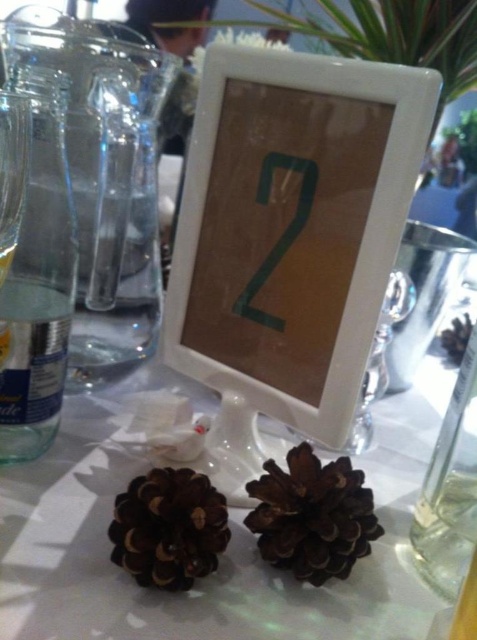
Question: Does brown textured pine cone at center appear over brown matte pine cone at lower left?

Choices:
 (A) yes
 (B) no

Answer: (A)

Question: Which of the following is the closest to the observer?

Choices:
 (A) (448, 429)
 (B) (140, 484)

Answer: (B)

Question: Can you confirm if brown matte pine cone at lower left is positioned above clear glass bottle at right?

Choices:
 (A) no
 (B) yes

Answer: (A)

Question: Which point is farther to the camera?

Choices:
 (A) clear glass bottle at left
 (B) clear glass bottle at right

Answer: (B)

Question: Which point is farther from the camera taking this photo?

Choices:
 (A) (13, 266)
 (B) (284, 230)
 (C) (311, 529)
 (D) (201, 573)

Answer: (B)

Question: Considering the relative positions of clear glass bottle at left and brown textured pine cone at center in the image provided, where is clear glass bottle at left located with respect to brown textured pine cone at center?

Choices:
 (A) below
 (B) above

Answer: (B)